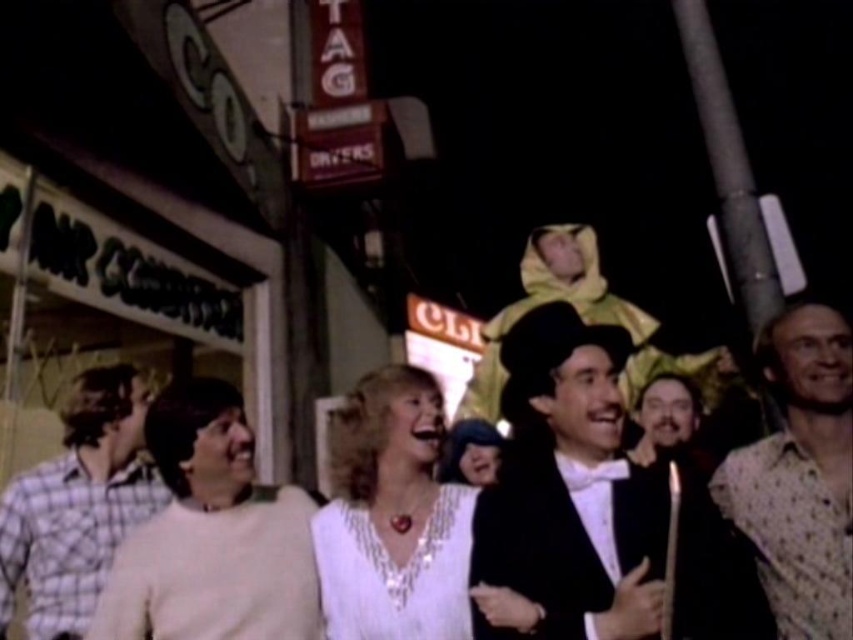
In the nighttime street scene, there are two people of interest. The first is wearing a plaid cotton shirt at left, and the second is a bearded man at center. Based on their positions, which person is closer to the left side of the image?

The plaid cotton shirt at left is to the left of bearded man at center, so the person wearing the plaid cotton shirt at left is closer to the left side of the image.